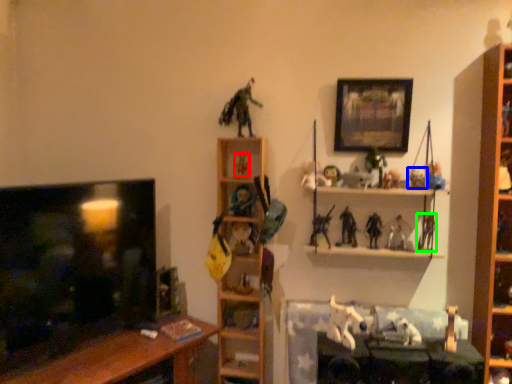
Question: Which object is the closest to the toy (highlighted by a red box)? Choose among these: toy (highlighted by a blue box) or toy (highlighted by a green box).

Choices:
 (A) toy
 (B) toy

Answer: (A)